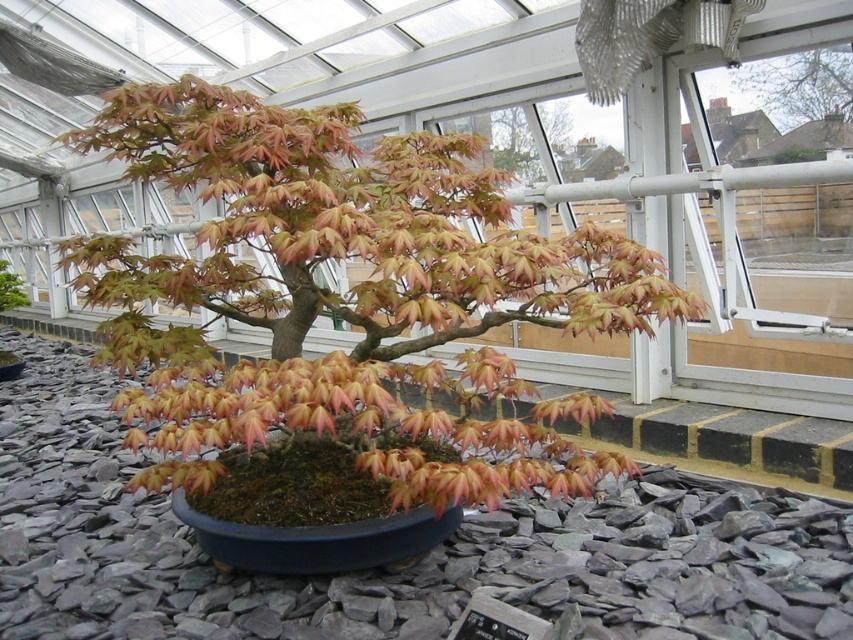
Question: Which object is the farthest from the orange-brown bark tree at upper center?

Choices:
 (A) orange-brown bark tree at upper right
 (B) gray gravel at center
 (C) matte orange maple at center

Answer: (B)

Question: Which is farther from the gray gravel at center?

Choices:
 (A) orange-brown bark tree at upper center
 (B) matte orange maple at center
 (C) orange-brown bark tree at upper right

Answer: (A)

Question: Considering the relative positions of matte orange maple at center and gray gravel at center in the image provided, where is matte orange maple at center located with respect to gray gravel at center?

Choices:
 (A) above
 (B) below

Answer: (A)

Question: Based on their relative distances, which object is nearer to the orange-brown bark tree at upper center?

Choices:
 (A) gray gravel at center
 (B) matte orange maple at center
 (C) orange-brown bark tree at upper right

Answer: (C)

Question: Is orange-brown bark tree at upper right above orange-brown bark tree at upper center?

Choices:
 (A) yes
 (B) no

Answer: (B)

Question: Can you confirm if matte orange maple at center is smaller than gray gravel at center?

Choices:
 (A) yes
 (B) no

Answer: (B)